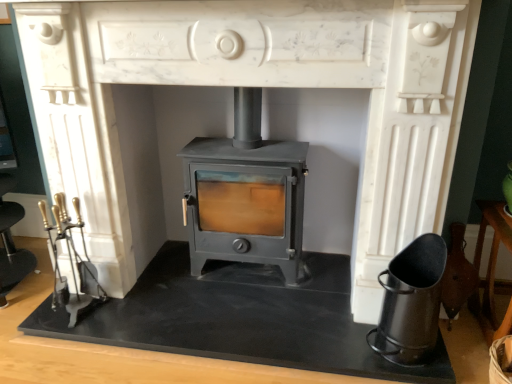
Question: Is matte gray wood burning stove at center at the back of black matte ash bucket at lower right?

Choices:
 (A) yes
 (B) no

Answer: (B)

Question: Considering the relative sizes of black matte ash bucket at lower right and matte gray wood burning stove at center in the image provided, is black matte ash bucket at lower right shorter than matte gray wood burning stove at center?

Choices:
 (A) yes
 (B) no

Answer: (A)

Question: Are black matte ash bucket at lower right and matte gray wood burning stove at center beside each other?

Choices:
 (A) yes
 (B) no

Answer: (B)

Question: From a real-world perspective, is black matte ash bucket at lower right located higher than matte gray wood burning stove at center?

Choices:
 (A) no
 (B) yes

Answer: (A)

Question: Is black matte ash bucket at lower right aimed at matte gray wood burning stove at center?

Choices:
 (A) no
 (B) yes

Answer: (A)

Question: Is black matte ash bucket at lower right wider than matte gray wood burning stove at center?

Choices:
 (A) yes
 (B) no

Answer: (B)

Question: Is black matte ash bucket at lower right inside matte gray wood burning stove at center?

Choices:
 (A) no
 (B) yes

Answer: (A)

Question: Is matte gray wood burning stove at center not close to black matte ash bucket at lower right?

Choices:
 (A) no
 (B) yes

Answer: (A)

Question: From a real-world perspective, is matte gray wood burning stove at center positioned over black matte ash bucket at lower right based on gravity?

Choices:
 (A) no
 (B) yes

Answer: (B)

Question: Does matte gray wood burning stove at center appear on the left side of black matte ash bucket at lower right?

Choices:
 (A) yes
 (B) no

Answer: (A)

Question: Does matte gray wood burning stove at center have a larger size compared to black matte ash bucket at lower right?

Choices:
 (A) yes
 (B) no

Answer: (A)

Question: Is matte gray wood burning stove at center located outside black matte ash bucket at lower right?

Choices:
 (A) no
 (B) yes

Answer: (B)

Question: Is matte gray wood burning stove at center bigger than black slate at center?

Choices:
 (A) no
 (B) yes

Answer: (B)